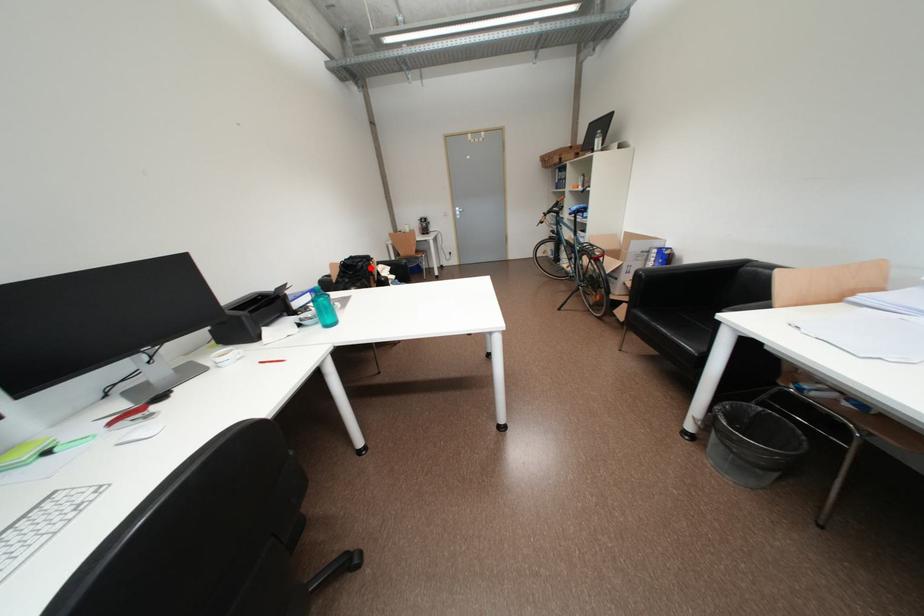
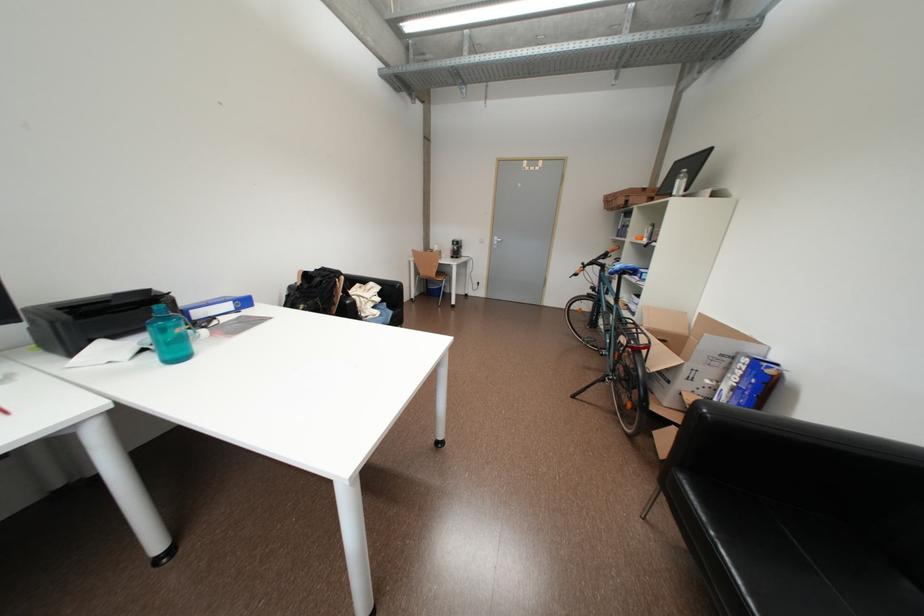
Locate, in the second image, the point that corresponds to the highlighted location in the first image.

(330, 284)